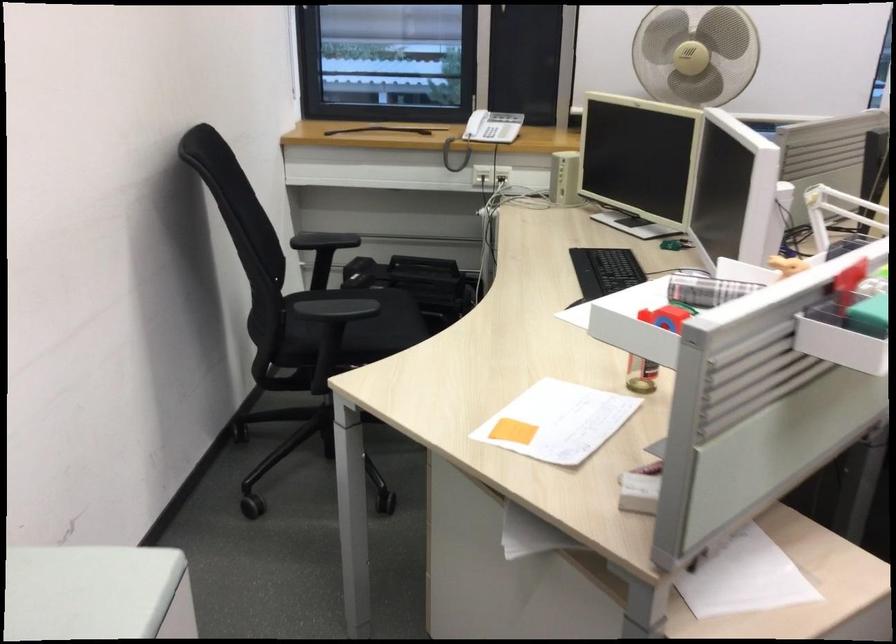
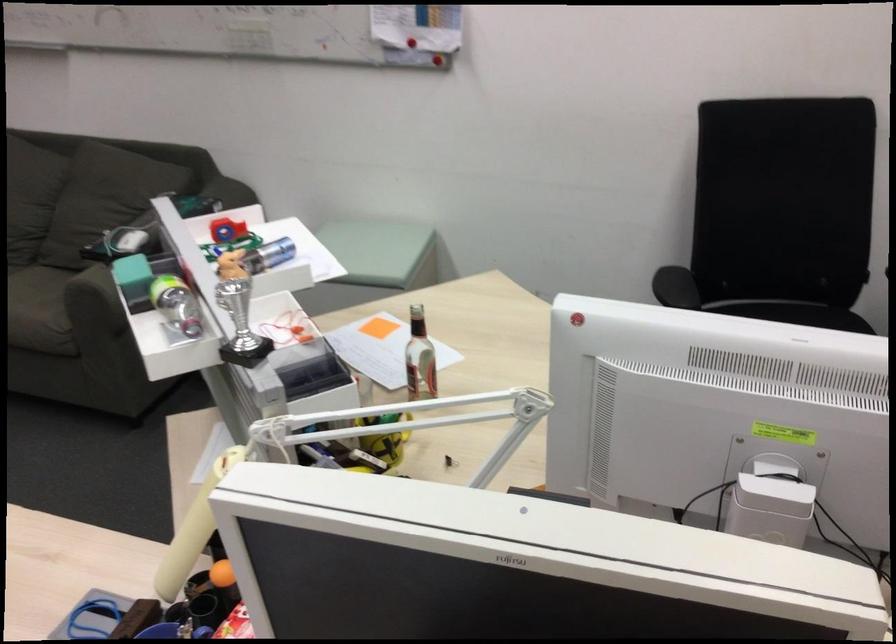
In the second image, find the point that corresponds to pixel 661 292 in the first image.

(274, 252)